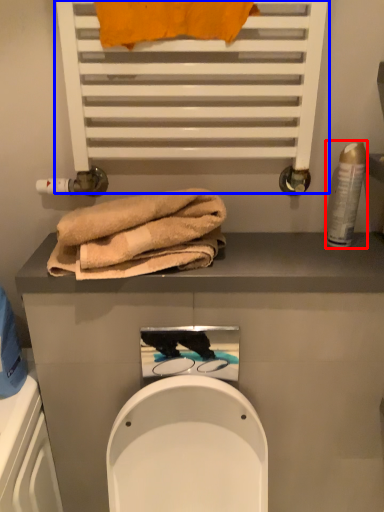
Question: Among these objects, which one is farthest to the camera, toiletry (highlighted by a red box) or shelf (highlighted by a blue box)?

Choices:
 (A) toiletry
 (B) shelf

Answer: (A)